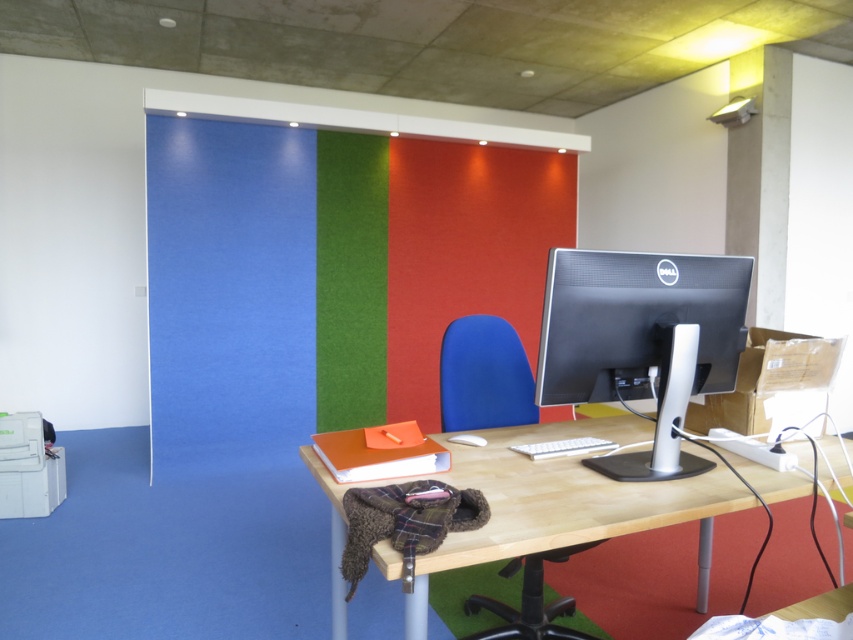
Looking at this image, you are an office worker who needs to locate a specific point on the desk. The coordinates given are point (641,340). Based on the scene description, which object is located at this coordinate?

The point (641,340) marks the sleek silver monitor at center, which is located on the desk.